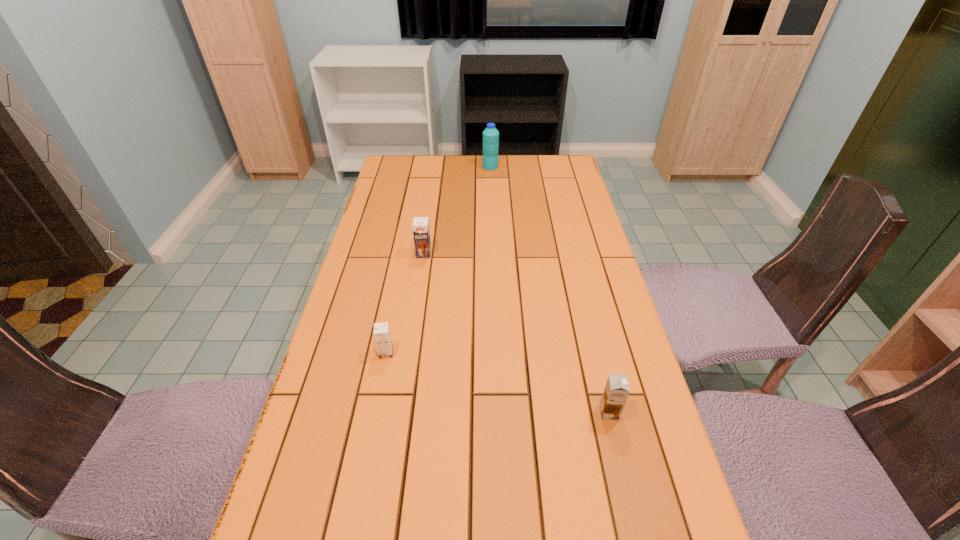
Find the location of a particular element. The height and width of the screenshot is (540, 960). object identified as the closest to the second object from left to right is located at coordinates (382, 336).

Choose which object is the second nearest neighbor to the farthest chocolate milk. Please provide its 2D coordinates. Your answer should be formatted as a tuple, i.e. [(x, y)], where the tuple contains the x and y coordinates of a point satisfying the conditions above.

[(490, 135)]

The width and height of the screenshot is (960, 540). I want to click on chocolate milk that stands as the closest to the third farthest object, so click(421, 232).

Identify which chocolate milk is the closest to the leftmost object. Please provide its 2D coordinates. Your answer should be formatted as a tuple, i.e. [(x, y)], where the tuple contains the x and y coordinates of a point satisfying the conditions above.

[(421, 232)]

You are a GUI agent. You are given a task and a screenshot of the screen. Output one action in this format:
    pyautogui.click(x=<x>, y=<y>)
    Task: Click on the free location that satisfies the following two spatial constraints: 1. on the back side of the second object from right to left; 2. on the right side of the second nearest object
    
    Given the screenshot: What is the action you would take?
    pyautogui.click(x=423, y=166)

Where is `vacant space that satisfies the following two spatial constraints: 1. on the front label of the nearest chocolate milk; 2. on the right side of the second chocolate milk from right to left`? Image resolution: width=960 pixels, height=540 pixels. vacant space that satisfies the following two spatial constraints: 1. on the front label of the nearest chocolate milk; 2. on the right side of the second chocolate milk from right to left is located at coordinates (x=400, y=413).